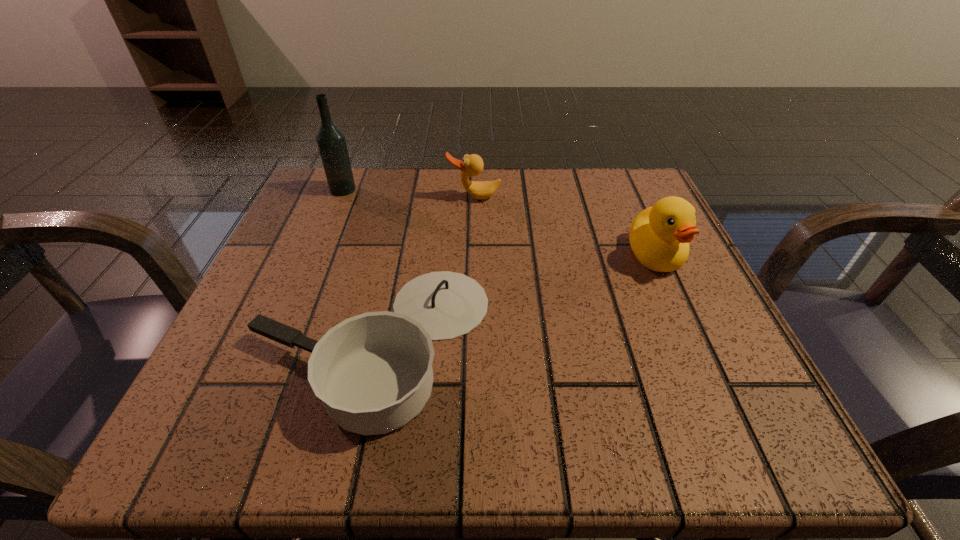
This screenshot has height=540, width=960. In the image, there is a desktop. What are the coordinates of `free space at the left edge` in the screenshot? It's located at (323, 233).

In the image, there is a desktop. At what (x,y) coordinates should I click in order to perform the action: click on free space at the right edge. Please return your answer as a coordinate pair (x, y). Image resolution: width=960 pixels, height=540 pixels. Looking at the image, I should click on (684, 366).

In the image, there is a desktop. Where is `vacant space at the far left corner`? The image size is (960, 540). vacant space at the far left corner is located at coordinates (348, 209).

The height and width of the screenshot is (540, 960). In the image, there is a desktop. In order to click on free region at the far right corner in this screenshot , I will do `click(602, 201)`.

In the image, there is a desktop. Where is `vacant space at the near right corner`? This screenshot has width=960, height=540. vacant space at the near right corner is located at coordinates (760, 391).

Identify the location of free space between the tallest object and the shorter duck. (408, 193).

Where is `empty location between the shortest object and the vodka`? Image resolution: width=960 pixels, height=540 pixels. empty location between the shortest object and the vodka is located at coordinates (358, 266).

You are a GUI agent. You are given a task and a screenshot of the screen. Output one action in this format:
    pyautogui.click(x=<x>, y=<y>)
    Task: Click on the free space between the shortest object and the taller duck
    This screenshot has height=540, width=960.
    Given the screenshot: What is the action you would take?
    [x=514, y=299]

Find the location of `vacant area that lies between the saucepan and the rightmost object`. vacant area that lies between the saucepan and the rightmost object is located at coordinates (514, 299).

Locate an element on the screen. vacant space in between the second shortest object and the taller duck is located at coordinates (564, 226).